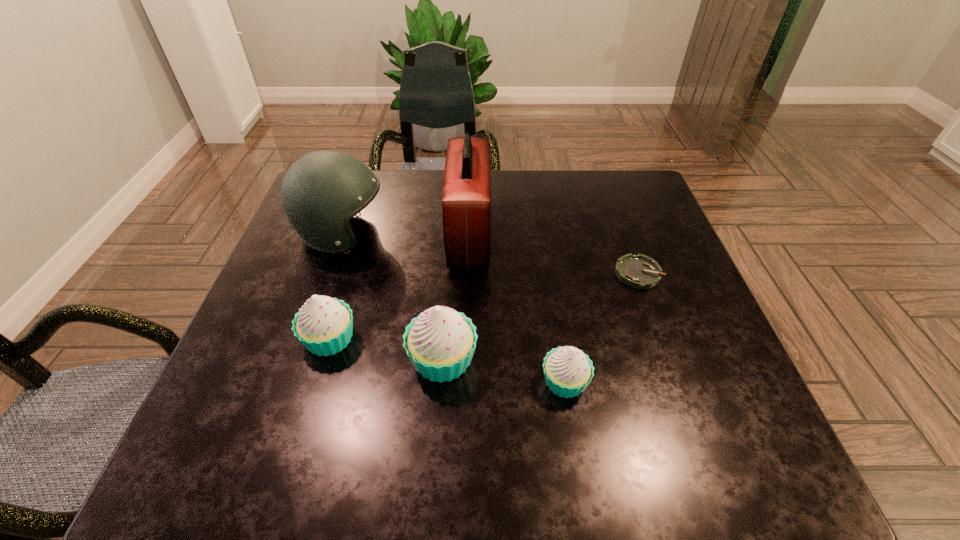
Locate an element on the screen. This screenshot has width=960, height=540. free space that satisfies the following two spatial constraints: 1. on the front side of the leftmost cupcake; 2. on the left side of the tallest cupcake is located at coordinates (324, 359).